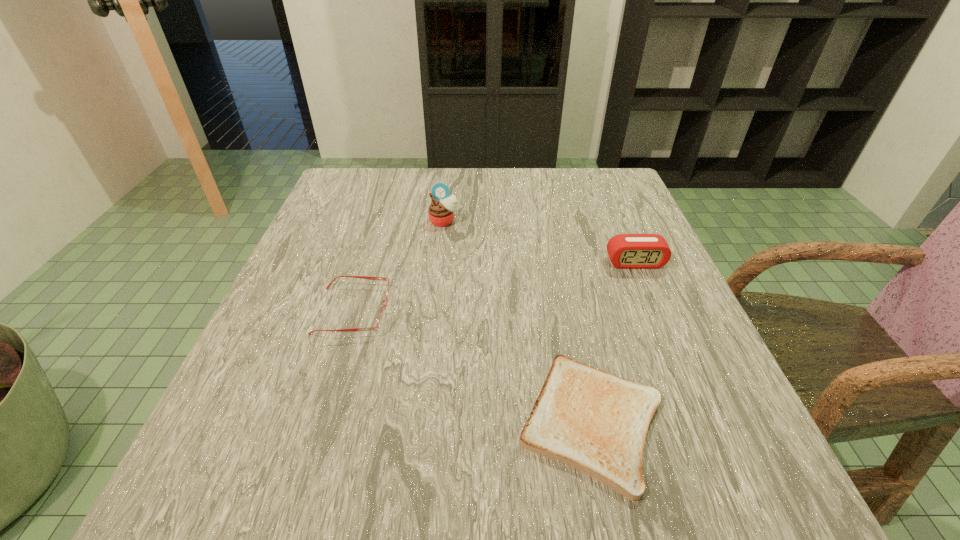
Locate an element on the screen. This screenshot has width=960, height=540. the tallest object is located at coordinates (442, 209).

Where is `muffin`? This screenshot has width=960, height=540. muffin is located at coordinates (442, 209).

Identify the location of alarm clock. (628, 251).

I want to click on the second tallest object, so click(x=628, y=251).

The image size is (960, 540). I want to click on the leftmost object, so click(x=381, y=318).

I want to click on spectacles, so click(381, 318).

This screenshot has height=540, width=960. In order to click on the shortest object in this screenshot , I will do `click(586, 418)`.

You are a GUI agent. You are given a task and a screenshot of the screen. Output one action in this format:
    pyautogui.click(x=<x>, y=<y>)
    Task: Click on the toast
    
    Given the screenshot: What is the action you would take?
    pyautogui.click(x=586, y=418)

The width and height of the screenshot is (960, 540). Identify the location of vacant space located on the front-facing side of the tallest object. (438, 275).

Identify the location of vacant space located 0.340m on the front-facing side of the alarm clock. (703, 423).